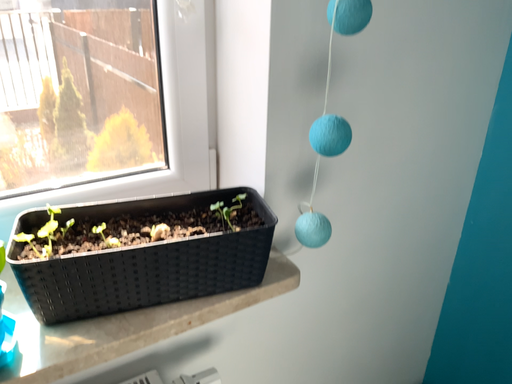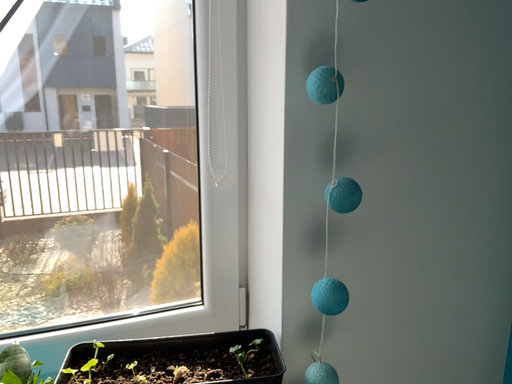
Question: Which way did the camera rotate in the video?

Choices:
 (A) rotated downward
 (B) rotated upward

Answer: (B)